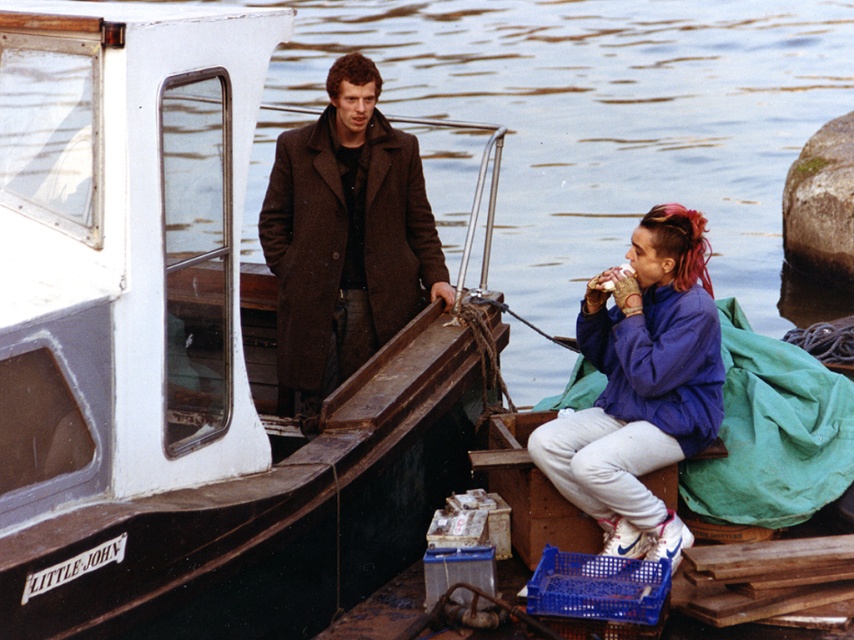
You are a photographer planning to take a group photo of the two people wearing the brown wool coat at left and purple fleece jacket at lower right. The minimum distance required for your camera to focus properly is 1.8 meters. Based on the scene, will the camera be able to focus on both subjects simultaneously?

The brown wool coat at left is 1.79 meters from the purple fleece jacket at lower right. Since the distance between them is slightly less than the camera requirement of 1.8 meters, the camera might struggle to focus on both subjects simultaneously.

You are a delivery drone with a wingspan of 1.5 meters. You need to fly between the white painted wood boat at center and the purple fleece jacket at lower right. Can you safely pass through the space between them without touching either object?

The distance between the white painted wood boat at center and the purple fleece jacket at lower right is 1.64 meters. Since your wingspan is 1.5 meters, there is enough space for you to pass safely between them.

You are a photographer trying to capture both the white painted wood boat at center and the purple fleece jacket at lower right in a single shot. Given that the boat is much bigger than the jacket, how might you position your camera to ensure both are clearly visible in the frame?

Since the white painted wood boat at center is larger than the purple fleece jacket at lower right, you can position the camera closer to the jacket and include the boat in the background to balance their sizes in the photo.